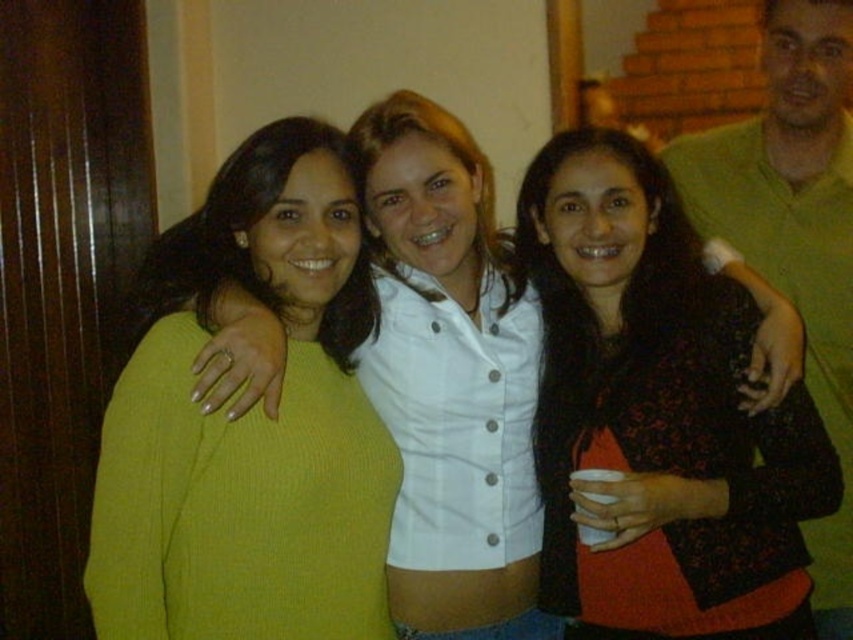
Question: Estimate the real-world distances between objects in this image. Which object is closer to the green matte shirt at upper right?

Choices:
 (A) black textured sweater at center
 (B) green ribbed sweater at left

Answer: (A)

Question: Can you confirm if green ribbed sweater at left is smaller than black textured sweater at center?

Choices:
 (A) no
 (B) yes

Answer: (B)

Question: Which point appears farthest from the camera in this image?

Choices:
 (A) (780, 160)
 (B) (729, 387)

Answer: (A)

Question: Where is green ribbed sweater at left located in relation to black textured sweater at center in the image?

Choices:
 (A) left
 (B) right

Answer: (A)

Question: Estimate the real-world distances between objects in this image. Which object is closer to the black textured sweater at center?

Choices:
 (A) green matte shirt at upper right
 (B) green ribbed sweater at left

Answer: (A)

Question: Is green ribbed sweater at left in front of green matte shirt at upper right?

Choices:
 (A) yes
 (B) no

Answer: (A)